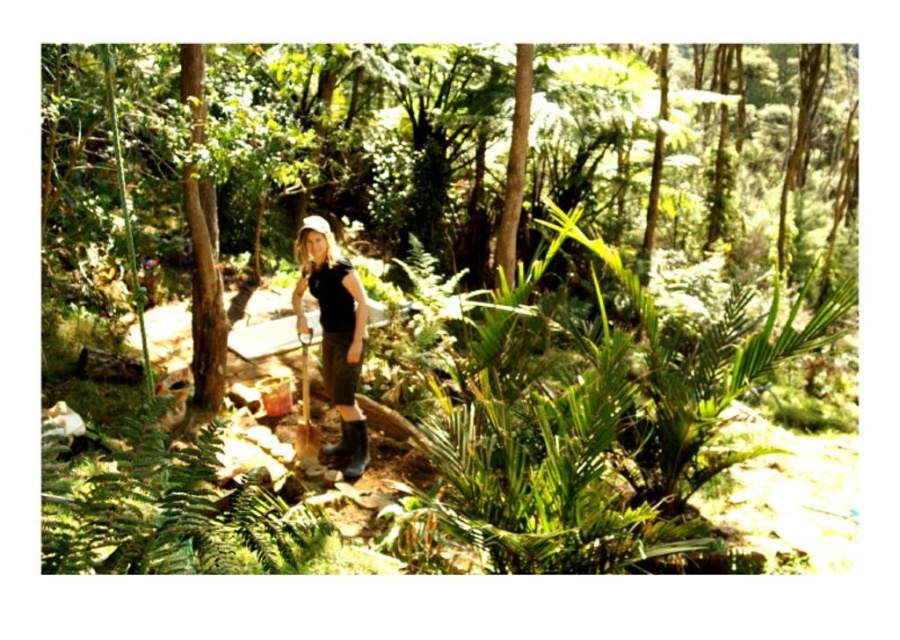
You are a gardener standing in the forest scene. You need to determine which object is shorter between the green leafy fern at center and the smooth brown tree trunk at left. Which one is shorter?

The green leafy fern at center is shorter than the smooth brown tree trunk at left.

You are a photographer trying to capture the person in the scene. Since the matte black shirt at center and the smooth brown tree trunk at left are both in the frame, which object takes up more visual space in the photo?

The smooth brown tree trunk at left takes up more visual space because the matte black shirt at center occupies less space than the smooth brown tree trunk at left.